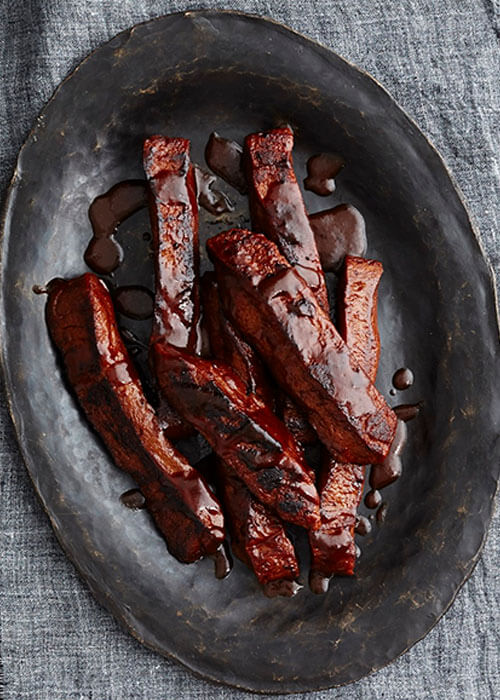
You are a GUI agent. You are given a task and a screenshot of the screen. Output one action in this format:
    pyautogui.click(x=<x>, y=<y>)
    Task: Click on the bottom part of the plate
    Image resolution: width=500 pixels, height=700 pixels.
    Given the screenshot: What is the action you would take?
    pyautogui.click(x=304, y=687)